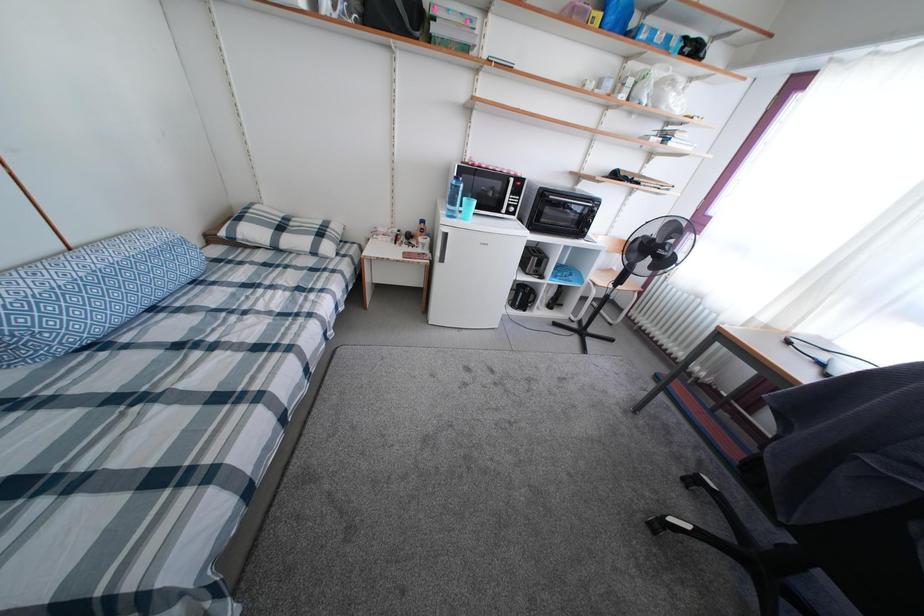
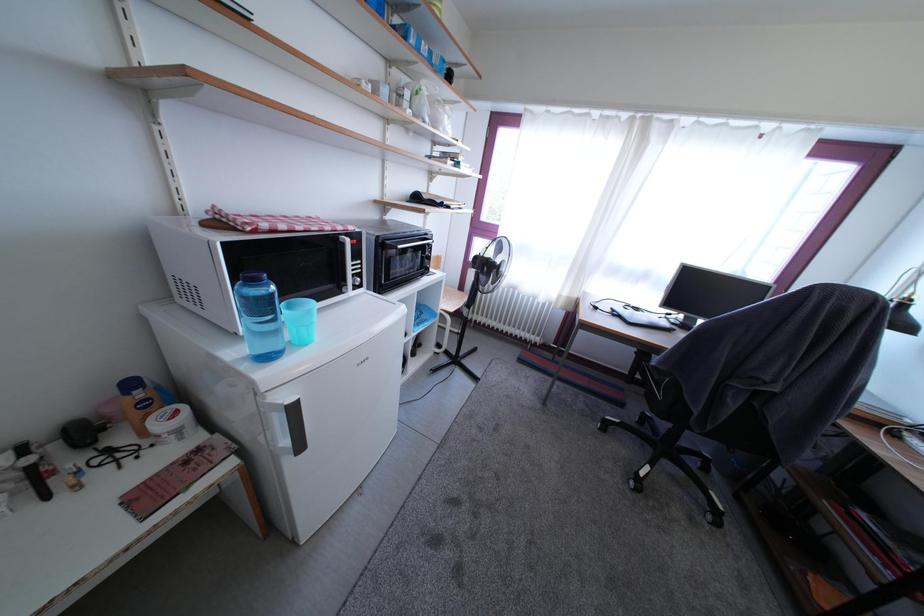
Question: How did the camera likely rotate?

Choices:
 (A) Left
 (B) Right
 (C) Up
 (D) Down

Answer: (B)